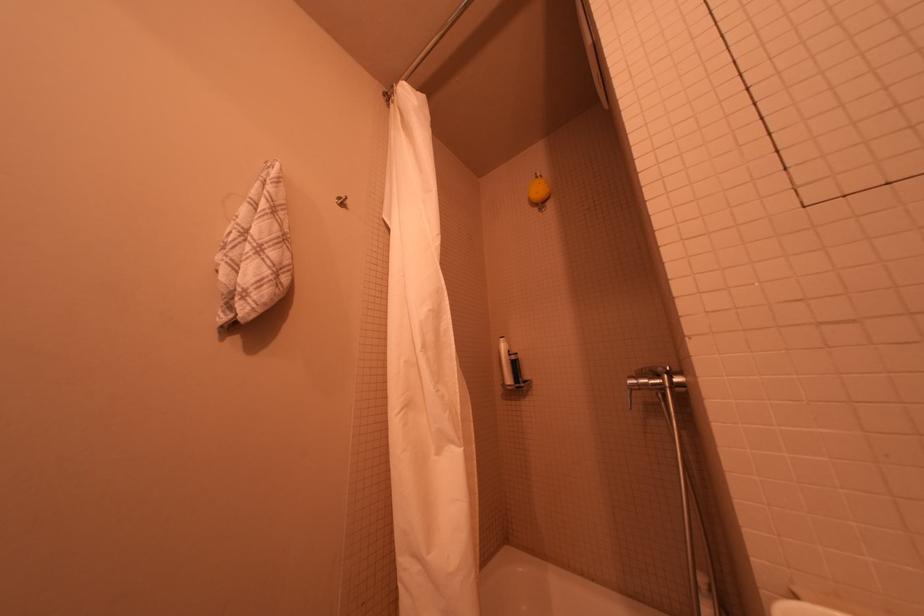
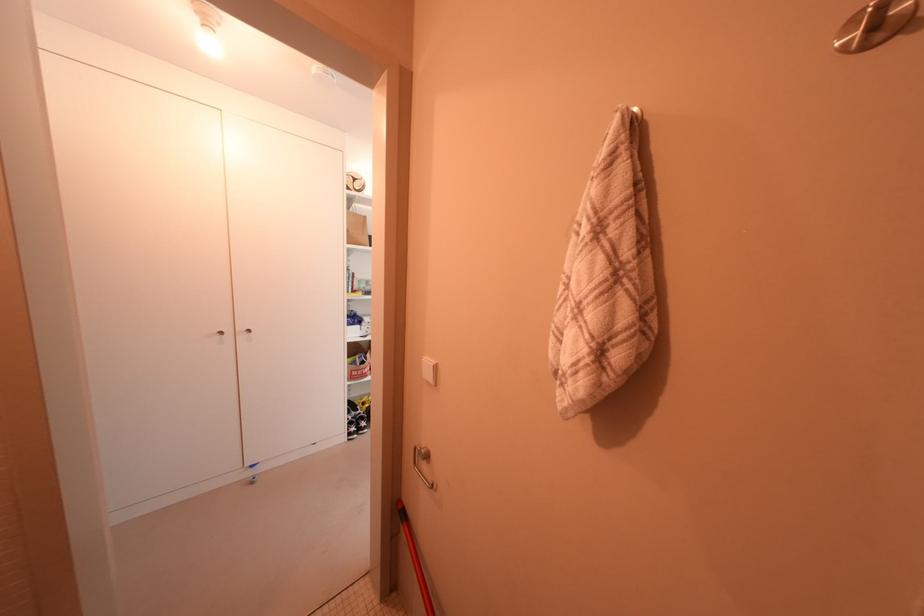
Question: The first image is from the beginning of the video and the second image is from the end. How did the camera likely rotate when shooting the video?

Choices:
 (A) Left
 (B) Right
 (C) Up
 (D) Down

Answer: (A)